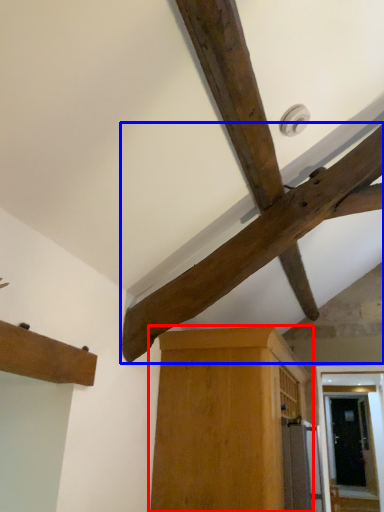
Question: Which object is closer to the camera taking this photo, cabinetry (highlighted by a red box) or beam (highlighted by a blue box)?

Choices:
 (A) cabinetry
 (B) beam

Answer: (B)